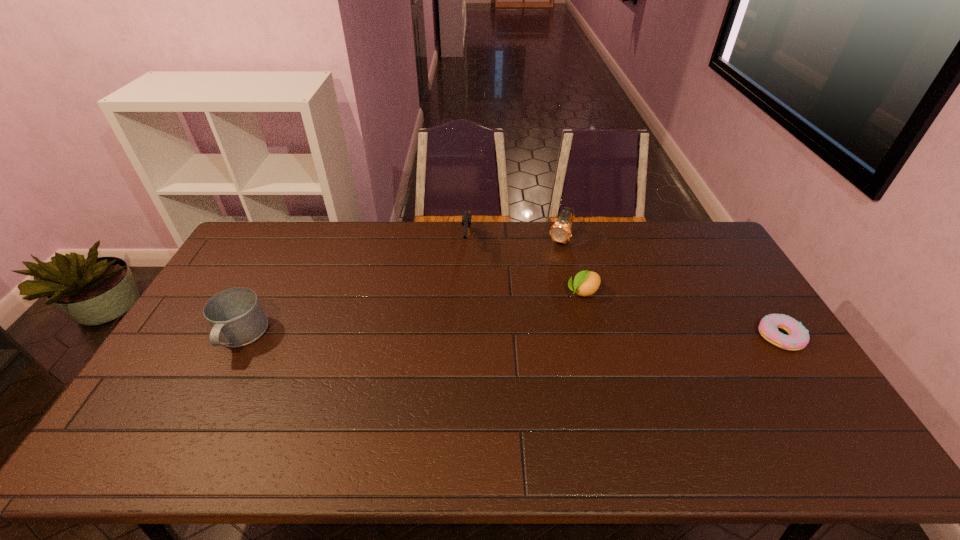
The image size is (960, 540). Identify the location of vacant space situated with leaves positioned above the third farthest object. (520, 338).

What are the coordinates of `free spot located 0.260m with leaves positioned above the third farthest object` in the screenshot? It's located at (516, 341).

This screenshot has width=960, height=540. I want to click on free space located on the face of the watch, so click(552, 259).

Locate an element on the screen. The width and height of the screenshot is (960, 540). vacant area situated 0.070m on the face of the watch is located at coordinates (551, 261).

Find the location of `vacant area situated 0.180m on the face of the watch`. vacant area situated 0.180m on the face of the watch is located at coordinates (541, 280).

Find the location of a particular element. The height and width of the screenshot is (540, 960). vacant region located 0.060m along the barrel of the fourth object from right to left is located at coordinates (466, 278).

Locate an element on the screen. vacant space located 0.260m along the barrel of the fourth object from right to left is located at coordinates (463, 322).

Where is `free spot located 0.310m along the barrel of the fourth object from right to left`? This screenshot has width=960, height=540. free spot located 0.310m along the barrel of the fourth object from right to left is located at coordinates (x=462, y=334).

Where is `watch situated at the far edge`? This screenshot has height=540, width=960. watch situated at the far edge is located at coordinates (560, 231).

I want to click on gun located at the far edge, so 466,217.